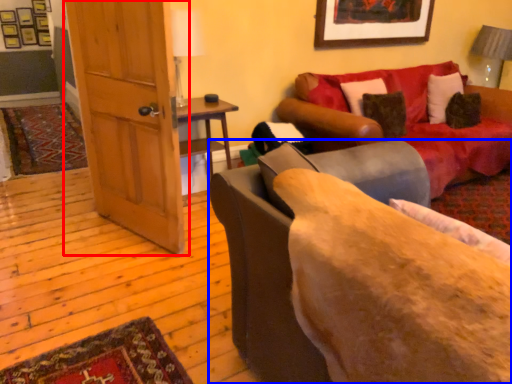
Question: Which object appears closest to the camera in this image, door (highlighted by a red box) or studio couch (highlighted by a blue box)?

Choices:
 (A) door
 (B) studio couch

Answer: (B)